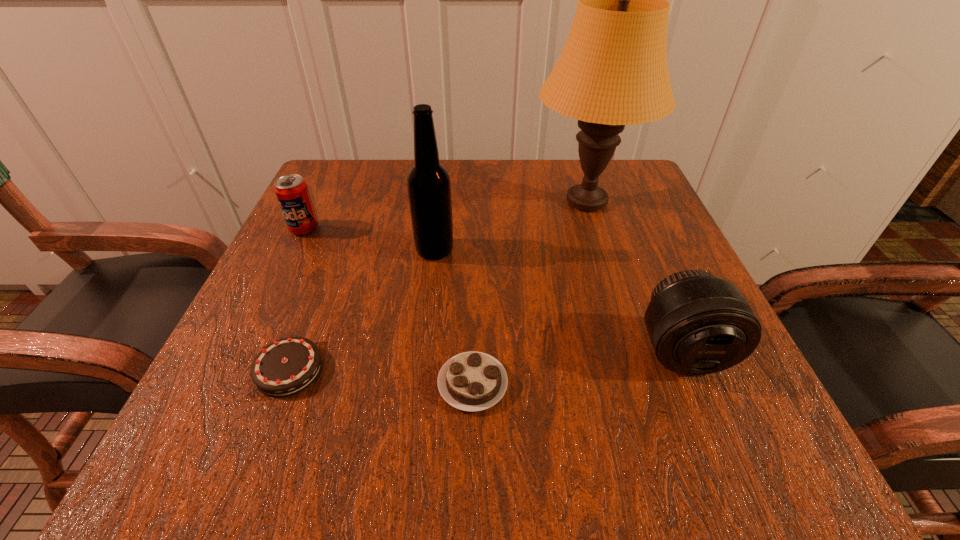
Find the location of `free space located on the back of the left chocolate cake`. free space located on the back of the left chocolate cake is located at coordinates (348, 214).

At what (x,y) coordinates should I click in order to perform the action: click on vacant space situated 0.220m on the left of the right chocolate cake. Please return your answer as a coordinate pair (x, y). Image resolution: width=960 pixels, height=540 pixels. Looking at the image, I should click on pos(283,383).

Find the location of a particular element. This screenshot has width=960, height=540. object that is positioned at the far edge is located at coordinates (613, 71).

At what (x,y) coordinates should I click in order to perform the action: click on object present at the near edge. Please return your answer as a coordinate pair (x, y). Looking at the image, I should click on (472, 381).

The image size is (960, 540). I want to click on soda can at the left edge, so click(291, 190).

Where is `chocolate cake positioned at the left edge`? The width and height of the screenshot is (960, 540). chocolate cake positioned at the left edge is located at coordinates (287, 366).

What are the coordinates of `lampshade that is at the right edge` in the screenshot? It's located at click(x=613, y=71).

Locate an element on the screen. The height and width of the screenshot is (540, 960). telephoto lens present at the right edge is located at coordinates click(x=698, y=324).

You are a GUI agent. You are given a task and a screenshot of the screen. Output one action in this format:
    pyautogui.click(x=<x>, y=<y>)
    Task: Click on the object located at the far right corner
    The width and height of the screenshot is (960, 540).
    Given the screenshot: What is the action you would take?
    coord(613,71)

Identify the location of vacant space at the far edge of the desktop. This screenshot has width=960, height=540. (491, 212).